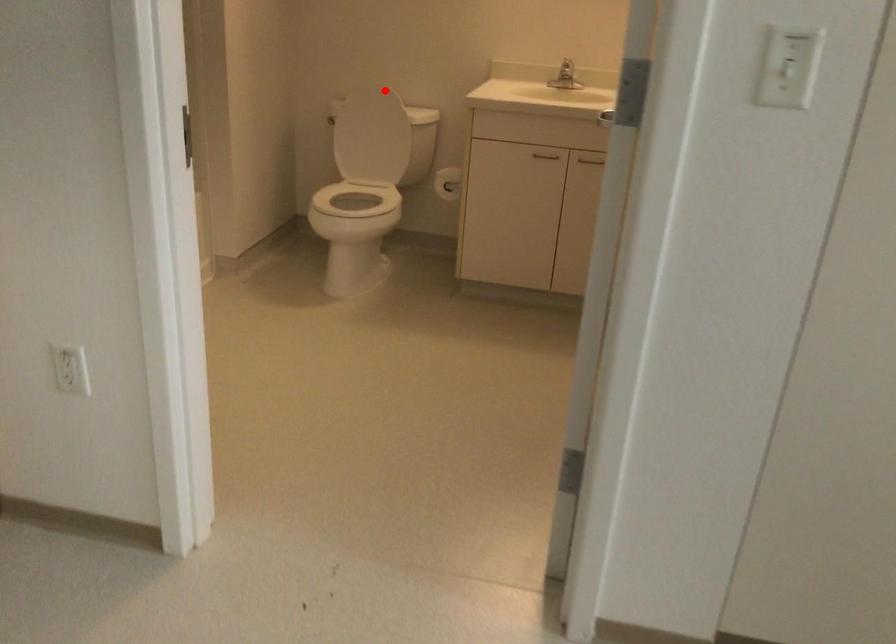
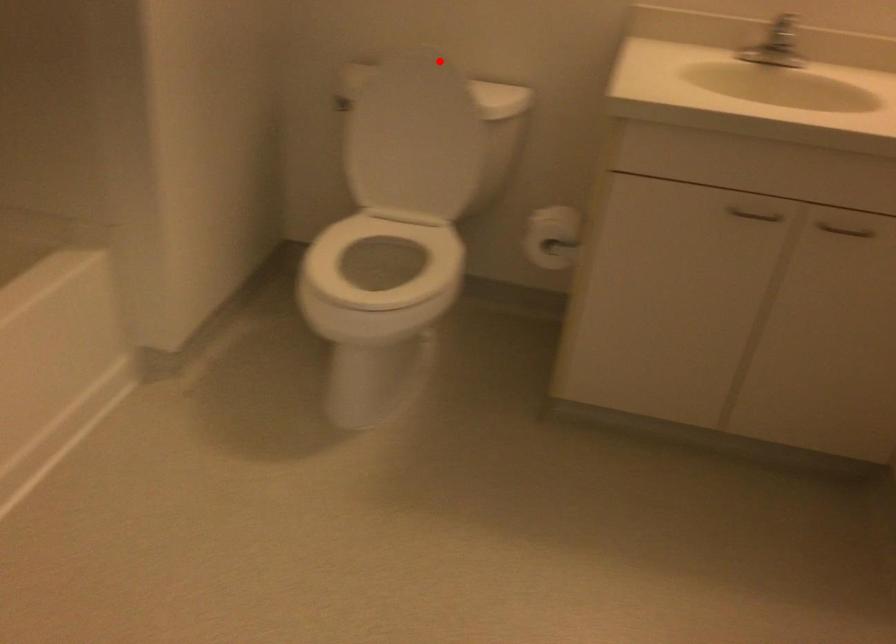
I am providing you with two images of the same scene from different viewpoints. A red point is marked on the first image and another point is marked on the second image. Is the red point in image1 aligned with the point shown in image2?

Yes